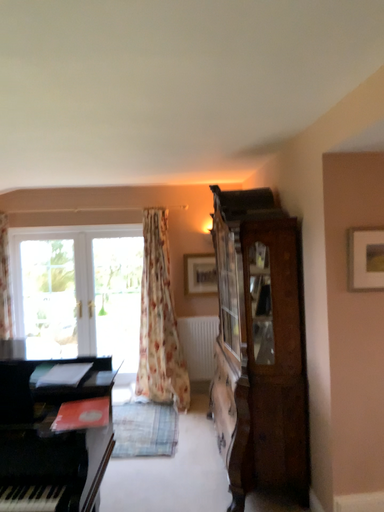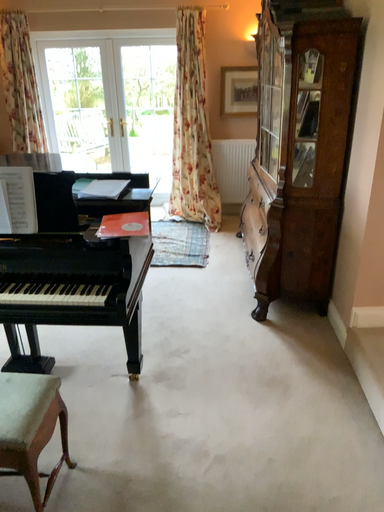
Question: How did the camera likely rotate when shooting the video?

Choices:
 (A) rotated upward
 (B) rotated downward

Answer: (B)